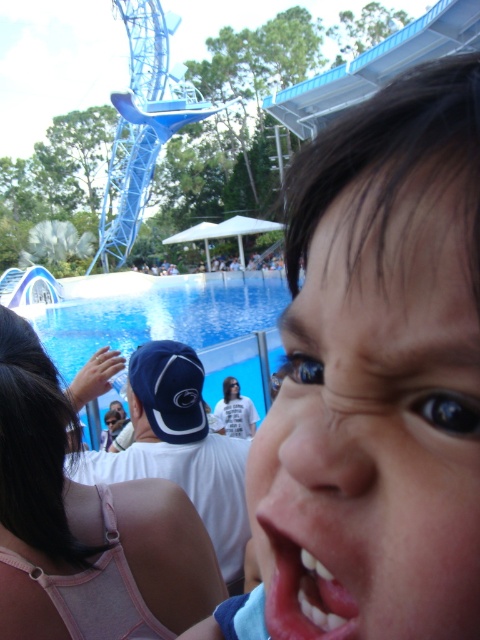
You are a photographer who just took a picture of a child at a marine park. The child is at the center of the image, and you noticed a point at coordinates (375, 424). What is located at that point?

The point at coordinates (375, 424) has the smooth skin face at center.

You are a photographer trying to capture the child in the marine park scene. The camera focuses on the point at coordinates (375, 424). Based on the scene description, where is this point located on the child?

The point at coordinates (375, 424) is located on the smooth skin face at center of the child.

You are a photographer trying to capture a clear shot of the pink fabric at center and the pink glossy lips at center in the marine park scene. Given that your camera has a depth of field that can focus on objects within a 40 feet range, will both objects be in focus at the same time?

The distance between the pink fabric at center and pink glossy lips at center is 44.71 feet, which exceeds the camera lens depth of field range of 40 feet. Therefore, both objects cannot be in focus simultaneously.